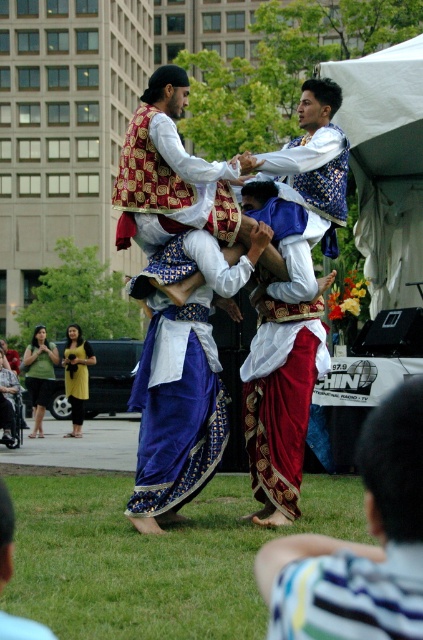
Question: Which point is farther to the camera?

Choices:
 (A) (43, 340)
 (B) (32, 636)
 (C) (87, 376)
 (D) (147, 122)

Answer: (A)

Question: Can you confirm if matte gold vest at center is bigger than striped fabric pants at lower right?

Choices:
 (A) yes
 (B) no

Answer: (A)

Question: Considering the real-world distances, which object is closest to the green fabric dress at lower left?

Choices:
 (A) matte gold vest at center
 (B) red silk sari at center
 (C) yellow fabric dress at lower left

Answer: (C)

Question: Observing the image, what is the correct spatial positioning of blue velvet pants at lower center in reference to yellow fabric dress at lower left?

Choices:
 (A) below
 (B) above

Answer: (B)

Question: Is matte gold vest at center thinner than green fabric dress at lower left?

Choices:
 (A) yes
 (B) no

Answer: (A)

Question: Estimate the real-world distances between objects in this image. Which object is farther from the matte gold vest at center?

Choices:
 (A) yellow fabric dress at lower left
 (B) green grass at lower center

Answer: (A)